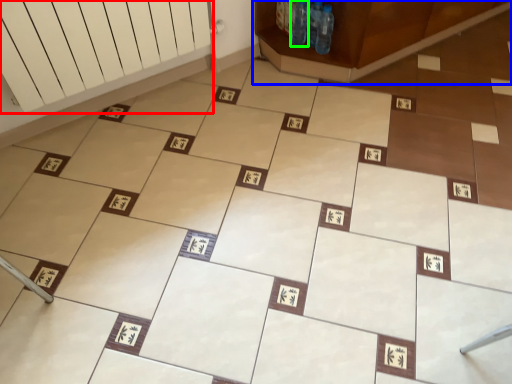
Question: Which object is positioned farthest from radiator (highlighted by a red box)? Select from furniture (highlighted by a blue box) and bottle (highlighted by a green box).

Choices:
 (A) furniture
 (B) bottle

Answer: (B)